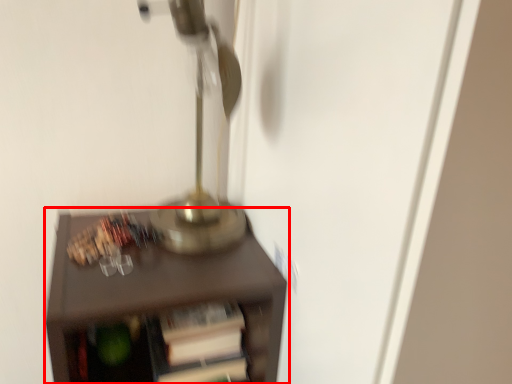
Question: In this image, where is furniture (annotated by the red box) located relative to table lamp?

Choices:
 (A) right
 (B) left

Answer: (B)